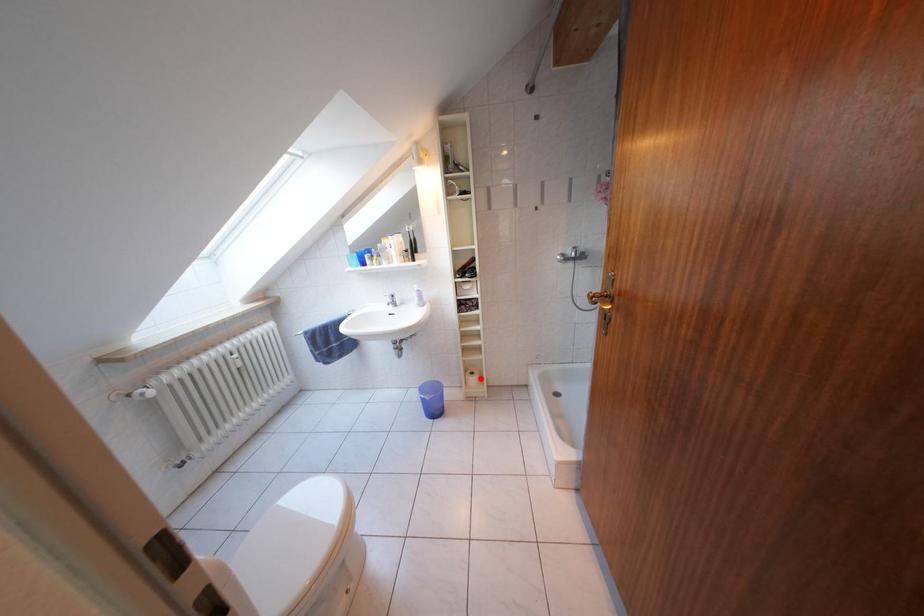
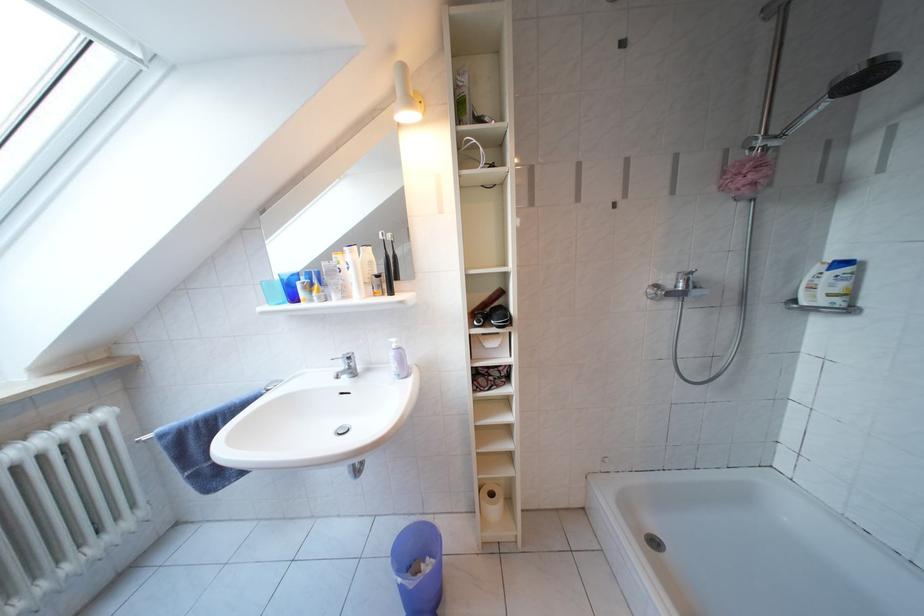
In the second image, find the point that corresponds to the highlighted location in the first image.

(500, 499)